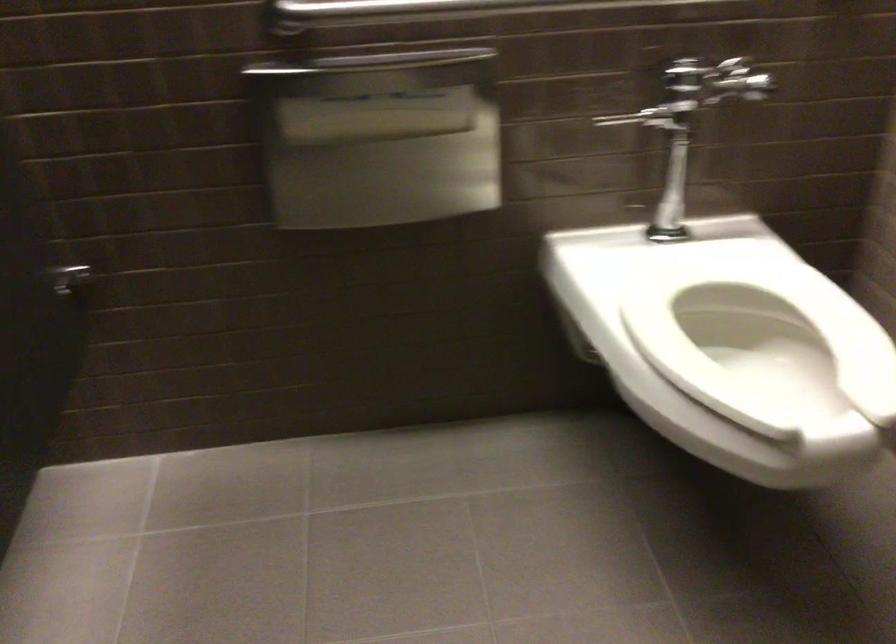
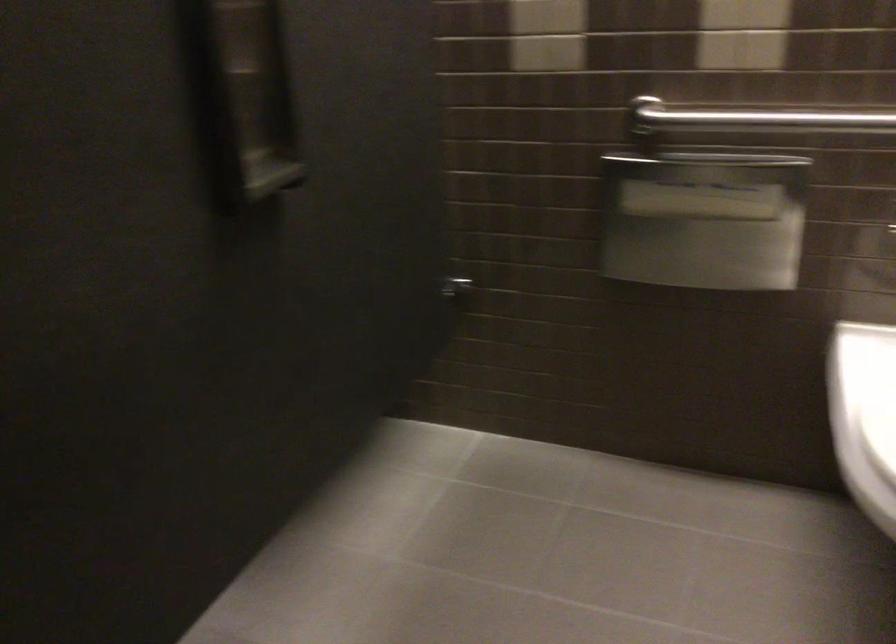
Find the pixel in the second image that matches point (392, 142) in the first image.

(703, 220)